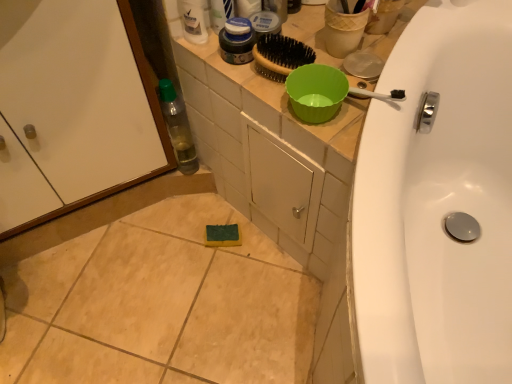
The width and height of the screenshot is (512, 384). What do you see at coordinates (237, 41) in the screenshot?
I see `matte plastic mouthwash at upper center` at bounding box center [237, 41].

At what (x,y) coordinates should I click in order to perform the action: click on white glossy bottle at upper center. Please return your answer as a coordinate pair (x, y). The width and height of the screenshot is (512, 384). Looking at the image, I should click on (193, 21).

Is matte plastic mouthwash at upper center inside the boundaries of white glossy screen door at lower left, or outside?

The correct answer is: outside.

From a real-world perspective, which is physically below, matte plastic mouthwash at upper center or white glossy screen door at lower left?

white glossy screen door at lower left, from a real-world perspective.

Is matte plastic mouthwash at upper center far from white glossy screen door at lower left?

No, matte plastic mouthwash at upper center is not far from white glossy screen door at lower left.

Is point (241, 29) farther from camera compared to point (69, 175)?

That is False.

Which of these two, matte plastic bowl at upper center or transparent plastic bottle at left, stands taller?

matte plastic bowl at upper center is taller.

Is matte plastic bowl at upper center oriented towards transparent plastic bottle at left?

Yes, matte plastic bowl at upper center is aimed at transparent plastic bottle at left.

Would you say matte plastic bowl at upper center contains transparent plastic bottle at left?

No, transparent plastic bottle at left is not surrounded by matte plastic bowl at upper center.

Is point (249, 118) positioned before point (163, 114)?

Yes, point (249, 118) is closer to viewer.

Which is in front, point (167, 122) or point (232, 7)?

Positioned in front is point (232, 7).

Between transparent plastic bottle at left and matte blue jar at upper center, which one is positioned in front?

Positioned in front is matte blue jar at upper center.

Is transparent plastic bottle at left oriented towards matte blue jar at upper center?

No, transparent plastic bottle at left is not facing towards matte blue jar at upper center.

From the picture: Does white glossy bottle at upper center appear on the right side of transparent plastic bottle at left?

Indeed, white glossy bottle at upper center is positioned on the right side of transparent plastic bottle at left.

Consider the image. Is white glossy bottle at upper center wider than transparent plastic bottle at left?

No, white glossy bottle at upper center is not wider than transparent plastic bottle at left.

From the image's perspective, is white glossy bottle at upper center beneath transparent plastic bottle at left?

Incorrect, from the image's perspective, white glossy bottle at upper center is higher than transparent plastic bottle at left.

From a real-world perspective, which is physically above, white glossy bottle at upper center or transparent plastic bottle at left?

In real-world perspective, white glossy bottle at upper center is above.

From the picture: Are matte plastic bowl at upper center and white glossy bottle at upper center making contact?

No.

How different are the orientations of matte plastic bowl at upper center and white glossy bottle at upper center in degrees?

The facing directions of matte plastic bowl at upper center and white glossy bottle at upper center are 91.3 degrees apart.

From a real-world perspective, is matte plastic bowl at upper center on white glossy bottle at upper center?

No, from a real-world perspective, matte plastic bowl at upper center is not above white glossy bottle at upper center.

Considering the sizes of matte plastic bowl at upper center and white glossy bottle at upper center in the image, is matte plastic bowl at upper center taller or shorter than white glossy bottle at upper center?

In the image, matte plastic bowl at upper center appears to be taller than white glossy bottle at upper center.

Looking at this image, from a real-world perspective, who is located higher, white glossy screen door at lower left or transparent plastic bottle at left?

white glossy screen door at lower left, from a real-world perspective.

At what (x,y) coordinates should I click in order to perform the action: click on bottle on the right of the white glossy screen door at lower left. Please return your answer as a coordinate pair (x, y). Looking at the image, I should click on (178, 128).

Is point (89, 25) closer to viewer compared to point (172, 121)?

Yes, it is.

From the picture: Is transparent plastic bottle at left surrounded by white glossy screen door at lower left?

No, transparent plastic bottle at left is not a part of white glossy screen door at lower left.

In terms of size, does matte blue jar at upper center appear bigger or smaller than white glossy screen door at lower left?

matte blue jar at upper center is smaller than white glossy screen door at lower left.

Is white glossy screen door at lower left at the back of matte blue jar at upper center?

That's not correct — matte blue jar at upper center is not looking away from white glossy screen door at lower left.

Between matte blue jar at upper center and white glossy screen door at lower left, which one has smaller width?

With smaller width is matte blue jar at upper center.

Where is `mouthwash on the right of white glossy screen door at lower left`? mouthwash on the right of white glossy screen door at lower left is located at coordinates (237, 41).

Locate an element on the screen. The width and height of the screenshot is (512, 384). bottle located underneath the matte plastic bowl at upper center (from a real-world perspective) is located at coordinates (178, 128).

Looking at the image, which one is located closer to matte plastic bowl at upper center, white glossy screen door at lower left or transparent plastic bottle at left?

Based on the image, transparent plastic bottle at left appears to be nearer to matte plastic bowl at upper center.

Which object lies further to the anchor point matte blue jar at upper center, matte plastic bowl at upper center or white glossy screen door at lower left?

The object further to matte blue jar at upper center is white glossy screen door at lower left.

Considering their positions, is matte plastic mouthwash at upper center positioned closer to white glossy screen door at lower left than transparent plastic bottle at left?

Based on the image, transparent plastic bottle at left appears to be nearer to white glossy screen door at lower left.

Considering their positions, is matte plastic mouthwash at upper center positioned further to transparent plastic bottle at left than matte blue jar at upper center?

matte blue jar at upper center is positioned further to the anchor transparent plastic bottle at left.

Looking at the image, which one is located closer to white glossy screen door at lower left, white glossy bottle at upper center or matte blue jar at upper center?

The object closer to white glossy screen door at lower left is white glossy bottle at upper center.

Which object lies nearer to the anchor point transparent plastic bottle at left, matte blue jar at upper center or white glossy screen door at lower left?

white glossy screen door at lower left is closer to transparent plastic bottle at left.

When comparing their distances from white glossy bottle at upper center, does matte plastic mouthwash at upper center or white glossy screen door at lower left seem further?

white glossy screen door at lower left is further to white glossy bottle at upper center.

Looking at the image, which one is located further to white glossy bottle at upper center, matte plastic bowl at upper center or white glossy screen door at lower left?

white glossy screen door at lower left is further to white glossy bottle at upper center.

Find the location of a particular element. The image size is (512, 384). cleaning product located between white glossy screen door at lower left and matte plastic bowl at upper center in the left-right direction is located at coordinates (193, 21).

Where is `cleaning product between transparent plastic bottle at left and matte plastic bowl at upper center from left to right`? Image resolution: width=512 pixels, height=384 pixels. cleaning product between transparent plastic bottle at left and matte plastic bowl at upper center from left to right is located at coordinates (193, 21).

Where is `mouthwash between transparent plastic bottle at left and matte plastic bowl at upper center in the horizontal direction`? The image size is (512, 384). mouthwash between transparent plastic bottle at left and matte plastic bowl at upper center in the horizontal direction is located at coordinates (237, 41).

Find the location of `mouthwash between white glossy bottle at upper center and transparent plastic bottle at left from top to bottom`. mouthwash between white glossy bottle at upper center and transparent plastic bottle at left from top to bottom is located at coordinates (237, 41).